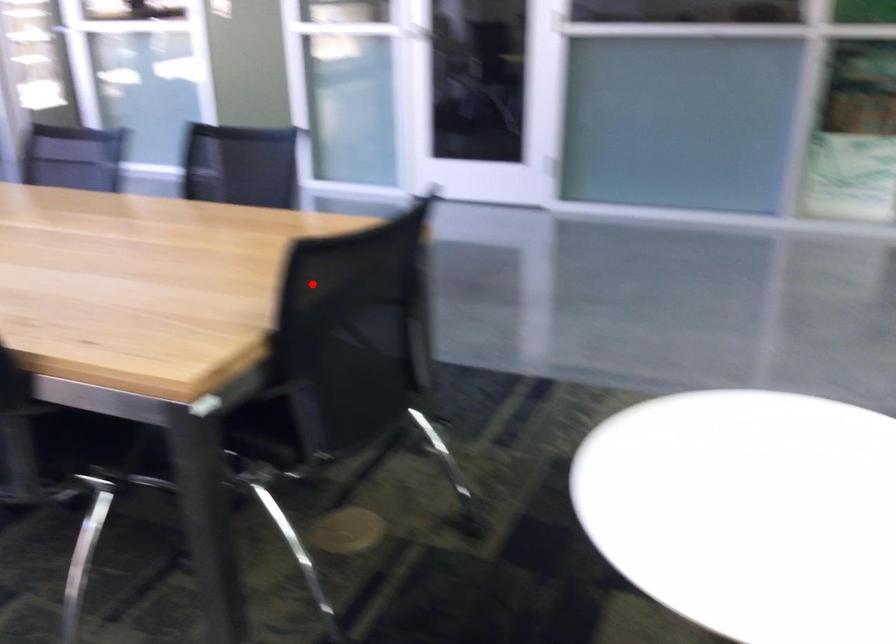
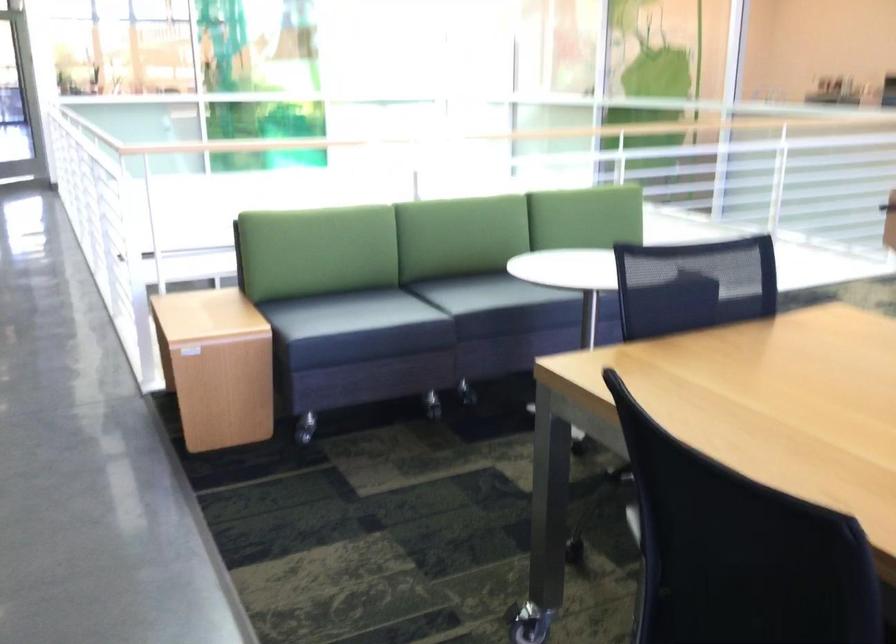
Question: I am providing you with two images of the same scene from different viewpoints. Given a red point in image1, look at the same physical point in image2. Is it:

Choices:
 (A) Closer to the viewpoint
 (B) Farther from the viewpoint

Answer: (B)